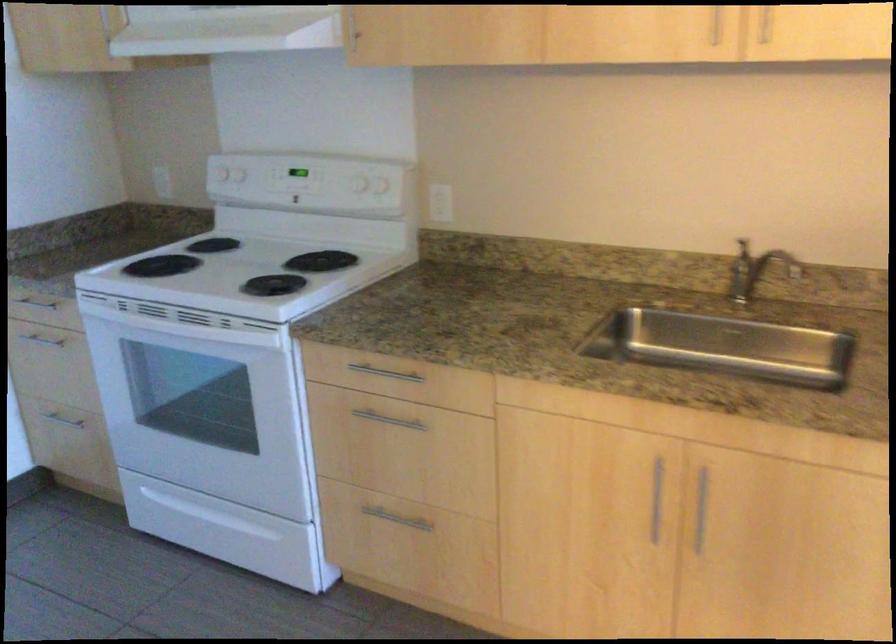
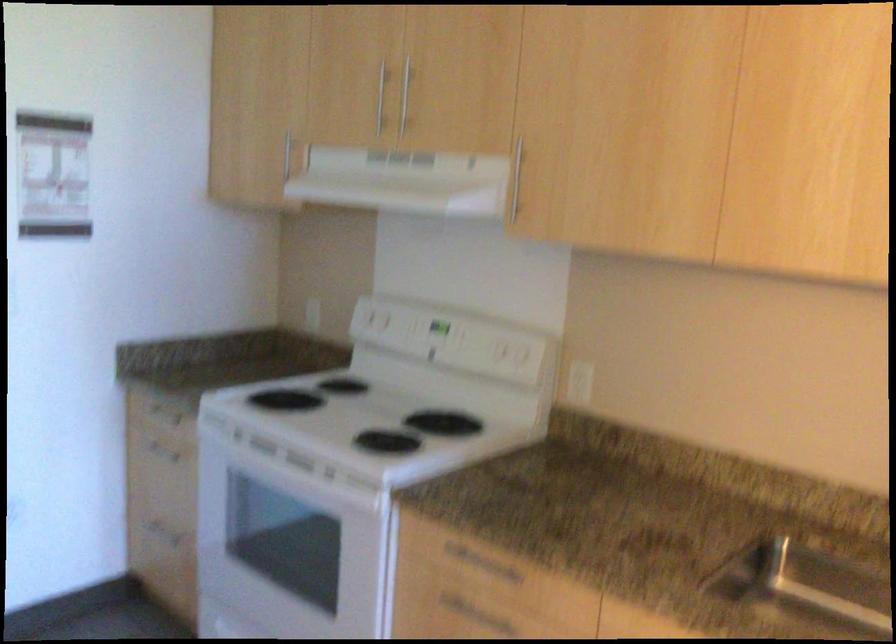
The point at (x=247, y=268) is marked in the first image. Where is the corresponding point in the second image?

(367, 415)